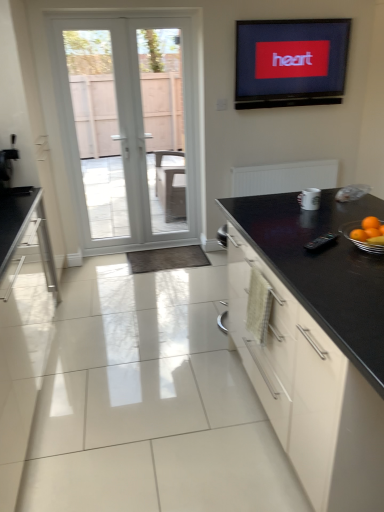
I want to click on free spot in front of white ceramic mug at upper right, which is the 2th appliance in bottom-to-top order, so click(x=337, y=216).